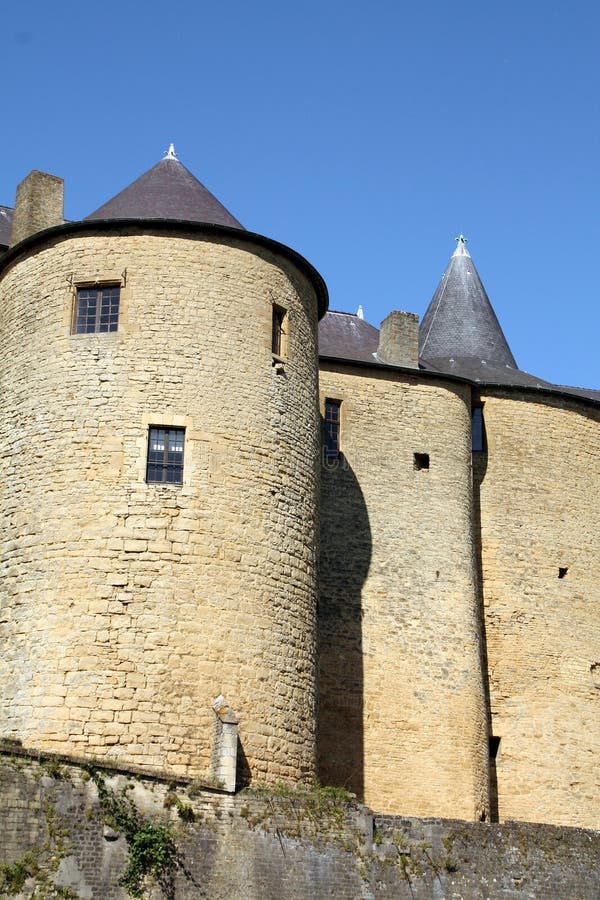
Find the location of a particular element. This screenshot has height=900, width=600. chimney is located at coordinates (403, 337), (34, 196).